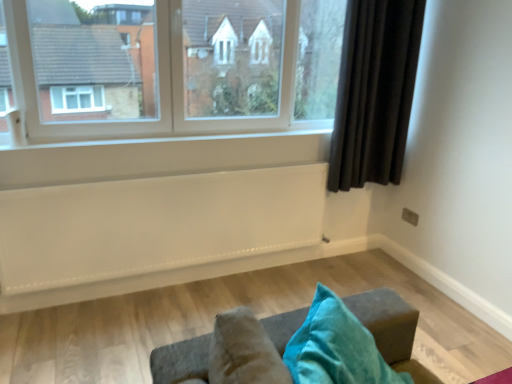
What do you see at coordinates (154, 232) in the screenshot? I see `white textured radiator at lower center` at bounding box center [154, 232].

At what (x,y) coordinates should I click in order to perform the action: click on white textured radiator at lower center. Please return your answer as a coordinate pair (x, y). This screenshot has height=384, width=512. Looking at the image, I should click on (154, 232).

Find the location of `clear glass window at upper center`. clear glass window at upper center is located at coordinates (172, 67).

Locate an element on the screen. This screenshot has width=512, height=384. dark fabric curtain at right is located at coordinates (375, 92).

Find the location of `white painted wood at center`. white painted wood at center is located at coordinates (208, 139).

Is dark fabric curtain at right positioned with its back to clear glass window at upper center?

No.

Is dark fabric curtain at right smaller than clear glass window at upper center?

Indeed, dark fabric curtain at right has a smaller size compared to clear glass window at upper center.

Is there a large distance between dark fabric curtain at right and clear glass window at upper center?

That's not correct — dark fabric curtain at right is a little close to clear glass window at upper center.

Is clear glass window at upper center located within dark fabric curtain at right?

No, clear glass window at upper center is not inside dark fabric curtain at right.

Based on the photo, is white textured radiator at lower center further to camera compared to white painted wood at center?

No.

Is white textured radiator at lower center completely or partially outside of white painted wood at center?

Yes.

Where is `radiator below the white painted wood at center (from a real-world perspective)`? radiator below the white painted wood at center (from a real-world perspective) is located at coordinates click(x=154, y=232).

From the image's perspective, is white textured radiator at lower center above white painted wood at center?

No.

From a real-world perspective, is white painted wood at center physically below clear glass window at upper center?

Yes, from a real-world perspective, white painted wood at center is beneath clear glass window at upper center.

Considering the sizes of white painted wood at center and clear glass window at upper center in the image, is white painted wood at center wider or thinner than clear glass window at upper center?

Clearly, white painted wood at center has more width compared to clear glass window at upper center.

Between white painted wood at center and clear glass window at upper center, which one is positioned behind?

Positioned behind is white painted wood at center.

From the image's perspective, which one is positioned lower, white painted wood at center or clear glass window at upper center?

From the image's view, white painted wood at center is below.

Does white painted wood at center turn towards dark fabric curtain at right?

No, white painted wood at center is not aimed at dark fabric curtain at right.

How many degrees apart are the facing directions of white painted wood at center and dark fabric curtain at right?

They differ by 1.36 degrees in their facing directions.

Is white painted wood at center beside dark fabric curtain at right?

No, white painted wood at center is not next to dark fabric curtain at right.

Does white painted wood at center contain dark fabric curtain at right?

Definitely not — dark fabric curtain at right is not inside white painted wood at center.

Is dark fabric curtain at right far from white painted wood at center?

They are positioned close to each other.

Based on the photo, how many degrees apart are the facing directions of dark fabric curtain at right and white painted wood at center?

1.36 degrees.

Who is taller, dark fabric curtain at right or white painted wood at center?

dark fabric curtain at right.

From a real-world perspective, is white textured radiator at lower center located beneath dark fabric curtain at right?

Correct, in the physical world, white textured radiator at lower center is lower than dark fabric curtain at right.

What's the angular difference between white textured radiator at lower center and dark fabric curtain at right's facing directions?

There is a 0.677-degree angle between the facing directions of white textured radiator at lower center and dark fabric curtain at right.

I want to click on curtain behind the white textured radiator at lower center, so click(375, 92).

Is white textured radiator at lower center spatially inside dark fabric curtain at right, or outside of it?

white textured radiator at lower center exists outside the volume of dark fabric curtain at right.

Based on the photo, how many degrees apart are the facing directions of clear glass window at upper center and white textured radiator at lower center?

The angular difference between clear glass window at upper center and white textured radiator at lower center is 0.321 degrees.

From a real-world perspective, is clear glass window at upper center below white textured radiator at lower center?

No.

Which object is further away from the camera, clear glass window at upper center or white textured radiator at lower center?

white textured radiator at lower center is further from the camera.

You are a GUI agent. You are given a task and a screenshot of the screen. Output one action in this format:
    pyautogui.click(x=<x>, y=<y>)
    Task: Click on the window above the white textured radiator at lower center (from a real-world perspective)
    This screenshot has height=384, width=512.
    Given the screenshot: What is the action you would take?
    pyautogui.click(x=172, y=67)

Locate an element on the screen. The image size is (512, 384). window on the left side of dark fabric curtain at right is located at coordinates (172, 67).

Identify the location of window sill on the right of white textured radiator at lower center. The width and height of the screenshot is (512, 384). (208, 139).

Estimate the real-world distances between objects in this image. Which object is further from white painted wood at center, dark fabric curtain at right or white textured radiator at lower center?

dark fabric curtain at right lies further to white painted wood at center than the other object.

Looking at the image, which one is located closer to white painted wood at center, white textured radiator at lower center or dark fabric curtain at right?

Among the two, white textured radiator at lower center is located nearer to white painted wood at center.

When comparing their distances from dark fabric curtain at right, does white textured radiator at lower center or white painted wood at center seem closer?

The object closer to dark fabric curtain at right is white painted wood at center.

Estimate the real-world distances between objects in this image. Which object is further from dark fabric curtain at right, white painted wood at center or clear glass window at upper center?

clear glass window at upper center lies further to dark fabric curtain at right than the other object.

Consider the image. Considering their positions, is dark fabric curtain at right positioned closer to clear glass window at upper center than white painted wood at center?

Among the two, white painted wood at center is located nearer to clear glass window at upper center.

From the picture: Which object lies nearer to the anchor point white textured radiator at lower center, dark fabric curtain at right or white painted wood at center?

white painted wood at center.

Looking at the image, which one is located closer to clear glass window at upper center, white textured radiator at lower center or dark fabric curtain at right?

The object closer to clear glass window at upper center is white textured radiator at lower center.

Looking at the image, which one is located further to dark fabric curtain at right, white painted wood at center or white textured radiator at lower center?

white textured radiator at lower center.

Find the location of a particular element. The height and width of the screenshot is (384, 512). window sill between clear glass window at upper center and white textured radiator at lower center vertically is located at coordinates (208, 139).

Find the location of a particular element. The width and height of the screenshot is (512, 384). window between white textured radiator at lower center and dark fabric curtain at right is located at coordinates (172, 67).

Where is `window located between white painted wood at center and dark fabric curtain at right in the left-right direction`? The image size is (512, 384). window located between white painted wood at center and dark fabric curtain at right in the left-right direction is located at coordinates (172, 67).

Where is `window sill between white textured radiator at lower center and dark fabric curtain at right`? The width and height of the screenshot is (512, 384). window sill between white textured radiator at lower center and dark fabric curtain at right is located at coordinates (208, 139).